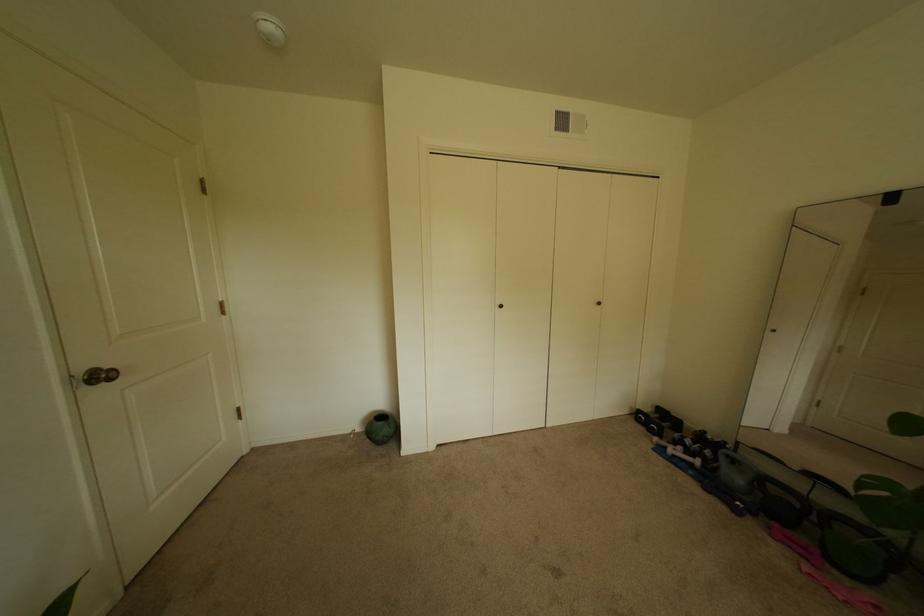
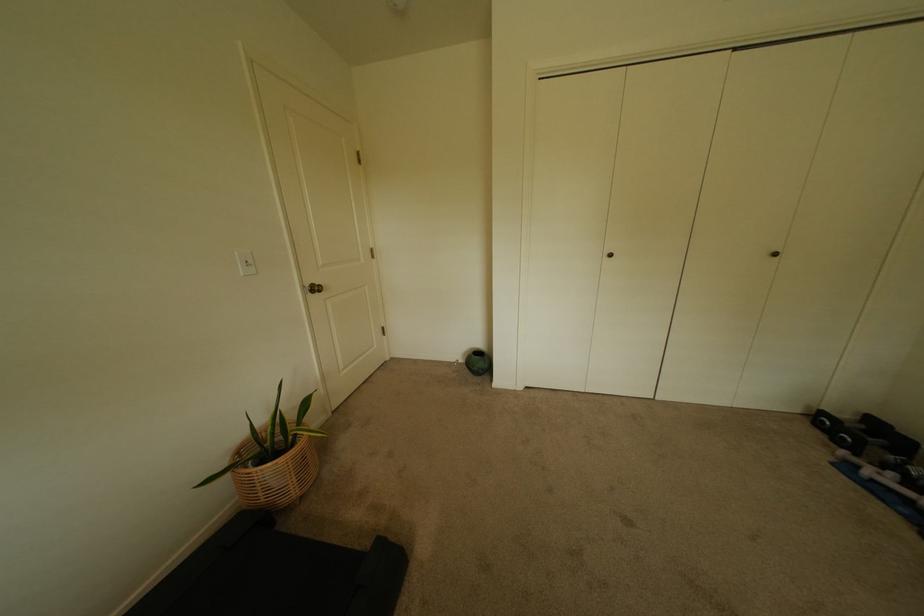
Locate, in the second image, the point that corresponds to point (608, 305) in the first image.

(784, 256)